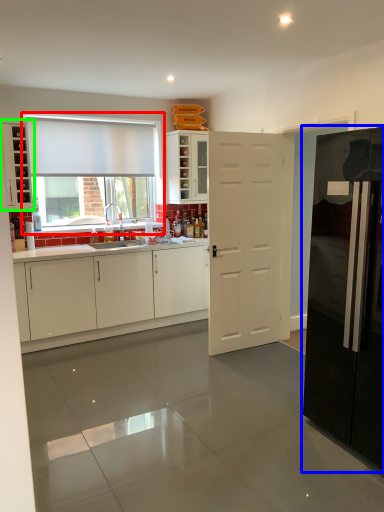
Question: Which object is the farthest from window (highlighted by a red box)? Choose among these: refrigerator (highlighted by a blue box) or cabinetry (highlighted by a green box).

Choices:
 (A) refrigerator
 (B) cabinetry

Answer: (A)